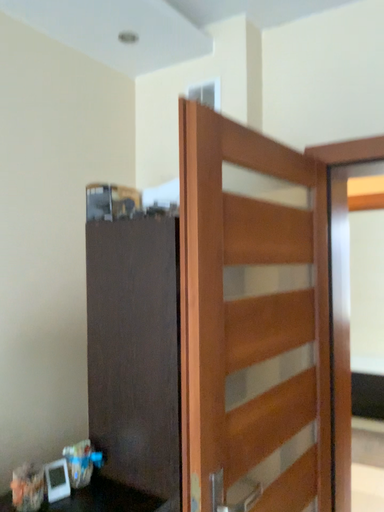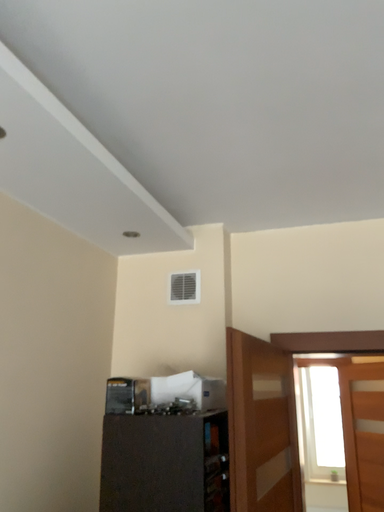
Question: How did the camera likely rotate when shooting the video?

Choices:
 (A) rotated left
 (B) rotated right

Answer: (B)